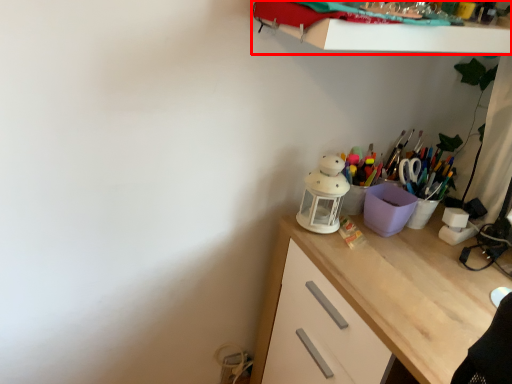
Question: In this image, where is shelf (annotated by the red box) located relative to desk?

Choices:
 (A) left
 (B) right

Answer: (A)